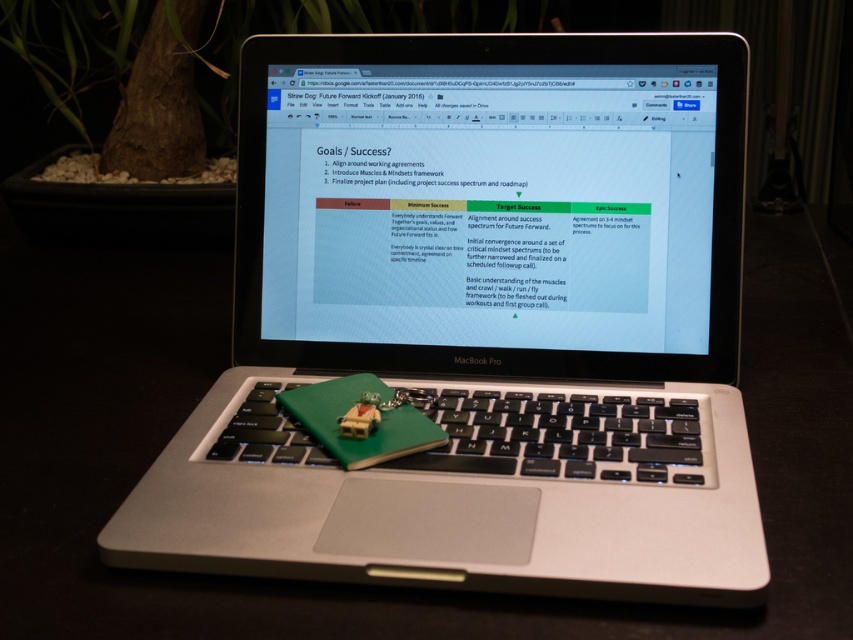
You are organizing a tech conference and need to set up a demo station. The demo requires both a laptop and a screen. Based on the scene, can the silver metallic laptop at center be connected to the satin black screen at center?

The silver metallic laptop at center is positioned under the satin black screen at center, which suggests they are part of the same device. Therefore, the laptop is likely built into the screen, making them a single unit. This means the laptop cannot be connected to an external screen as they are integrated together.

You are organizing a tech conference and need to set up a demo station. You have a silver metallic laptop at center and a satin black screen at center. The demo requires the laptop to be placed below the screen so that attendees can see both. Given their sizes, will the laptop fit below the screen without overlapping?

The silver metallic laptop at center is taller than the satin black screen at center, so placing the laptop below the screen would cause overlapping since the laptop is taller. Choose another arrangement where the laptop is beside the screen instead.

Looking at this image, what object is located at the coordinates point (480, 321) in the image?

The point (480, 321) indicates the silver metallic laptop at center.